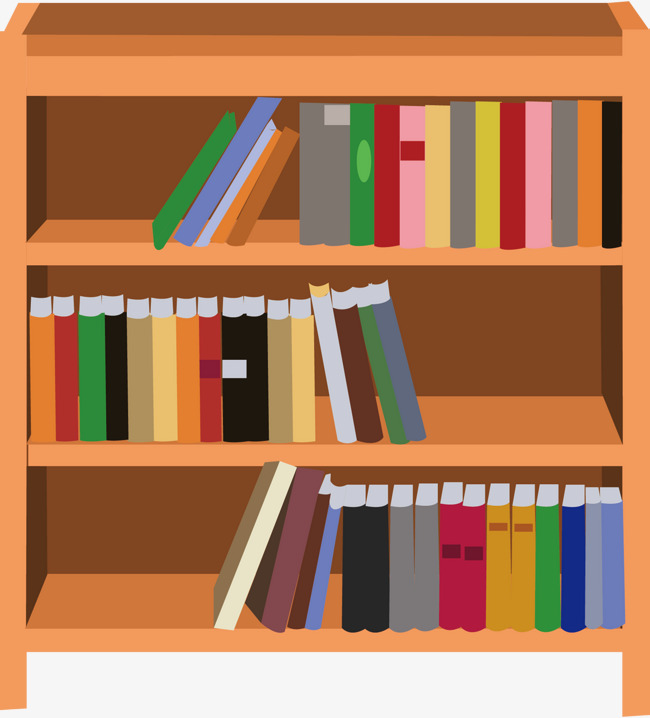
Find the location of a particular element. This screenshot has width=650, height=718. shelf levels is located at coordinates (195, 638), (307, 447), (312, 251), (300, 55).